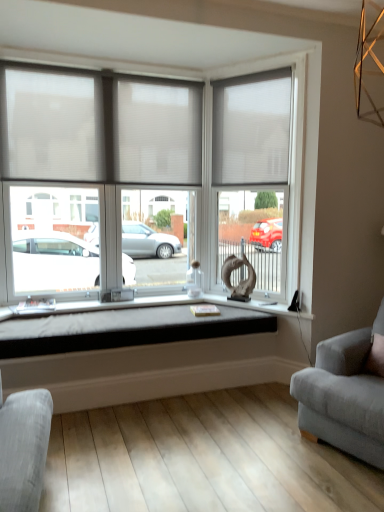
Question: Does white sheer blinds at upper left, the 1th window blind from the left, have a greater width compared to white fabric window blind at upper right, which is the 1th window blind in right-to-left order?

Choices:
 (A) no
 (B) yes

Answer: (B)

Question: From a real-world perspective, is white sheer blinds at upper left, the 1th window blind from the left, located beneath white fabric window blind at upper right, which is the 1th window blind in right-to-left order?

Choices:
 (A) no
 (B) yes

Answer: (B)

Question: Is white sheer blinds at upper left, the 1th window blind from the left, bigger than white fabric window blind at upper right, which is the 1th window blind in right-to-left order?

Choices:
 (A) no
 (B) yes

Answer: (B)

Question: Does white sheer blinds at upper left, the 1th window blind from the left, have a lesser width compared to white fabric window blind at upper right, which is the 1th window blind in right-to-left order?

Choices:
 (A) yes
 (B) no

Answer: (B)

Question: Is white fabric window blind at upper right, which is the 1th window blind in right-to-left order, inside white sheer blinds at upper left, arranged as the second window blind when viewed from the right?

Choices:
 (A) no
 (B) yes

Answer: (A)

Question: Is matte glass door at center situated inside soft gray fabric couch at right or outside?

Choices:
 (A) inside
 (B) outside

Answer: (B)

Question: Based on their positions, is matte glass door at center located to the left or right of soft gray fabric couch at right?

Choices:
 (A) right
 (B) left

Answer: (B)

Question: Is matte glass door at center in front of or behind soft gray fabric couch at right in the image?

Choices:
 (A) behind
 (B) front

Answer: (A)

Question: Is point (276, 260) positioned closer to the camera than point (349, 346)?

Choices:
 (A) closer
 (B) farther

Answer: (B)

Question: Is translucent fabric window at center bigger or smaller than soft gray fabric couch at right?

Choices:
 (A) big
 (B) small

Answer: (A)

Question: From a real-world perspective, relative to soft gray fabric couch at right, is translucent fabric window at center vertically above or below?

Choices:
 (A) above
 (B) below

Answer: (A)

Question: From the image's perspective, is translucent fabric window at center positioned above or below soft gray fabric couch at right?

Choices:
 (A) below
 (B) above

Answer: (B)

Question: Do you think translucent fabric window at center is within soft gray fabric couch at right, or outside of it?

Choices:
 (A) inside
 (B) outside

Answer: (B)

Question: Is point (279, 132) positioned closer to the camera than point (238, 99)?

Choices:
 (A) farther
 (B) closer

Answer: (B)

Question: From their relative heights in the image, would you say white fabric window blind at upper right, which is the 1th window blind in right-to-left order, is taller or shorter than translucent fabric window at center?

Choices:
 (A) tall
 (B) short

Answer: (B)